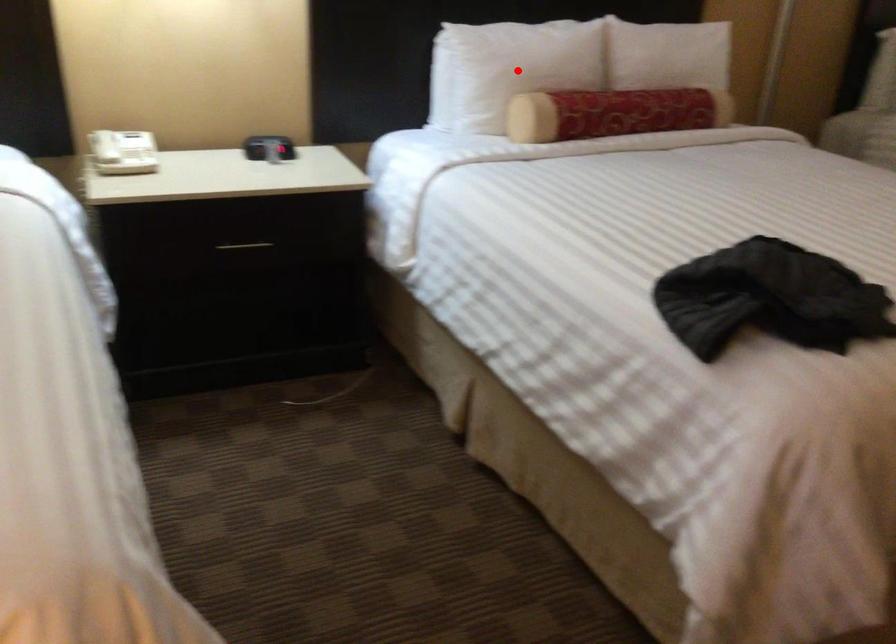
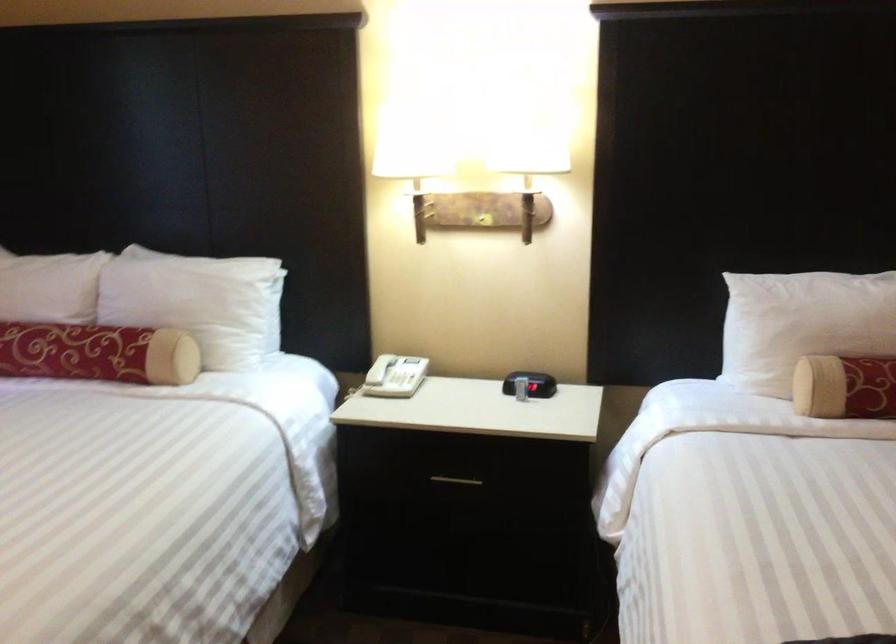
Find the pixel in the second image that matches the highlighted location in the first image.

(802, 324)